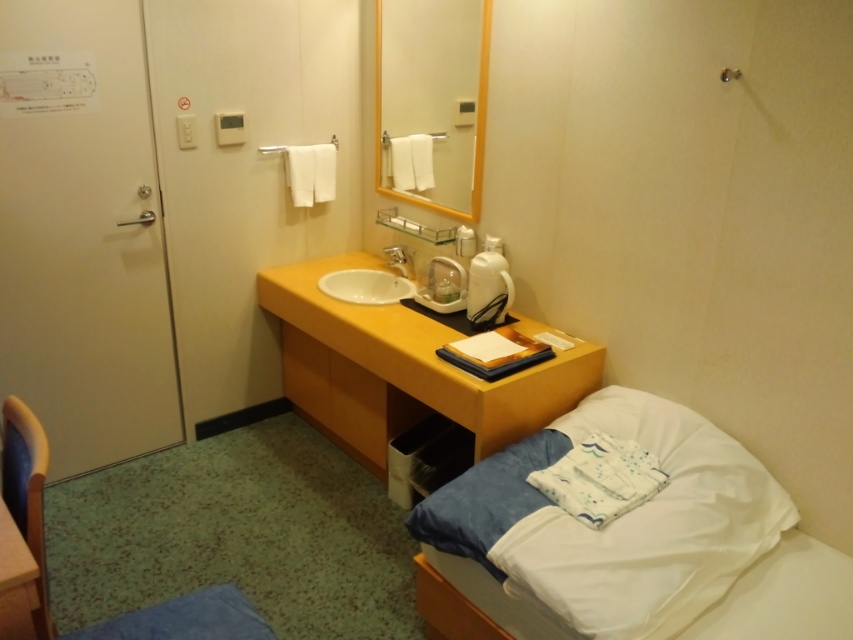
You are a hotel guest who wants to place a 12 inch wide decorative item between the yellow matte vanity at center and the white glossy sink at center. Can you fit it there?

The distance between the yellow matte vanity at center and the white glossy sink at center is 10.87 inches, which is less than the 12 inch width of the decorative item. Therefore, it cannot be placed between them.

You are staying in this hotel room and need to place a small lamp between the white soft bed at lower right and the yellow matte drawer at center. Based on their positions, which side of the drawer should you place the lamp?

The white soft bed at lower right is to the right of the yellow matte drawer at center, so you should place the lamp to the right side of the yellow matte drawer at center to position it between them.